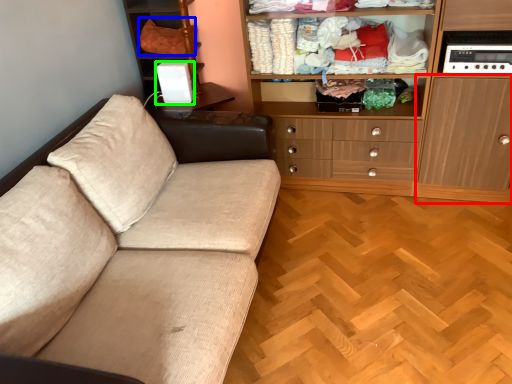
Question: Which object is positioned farthest from cabinetry (highlighted by a red box)? Select from clothing (highlighted by a blue box) and appliance (highlighted by a green box).

Choices:
 (A) clothing
 (B) appliance

Answer: (A)